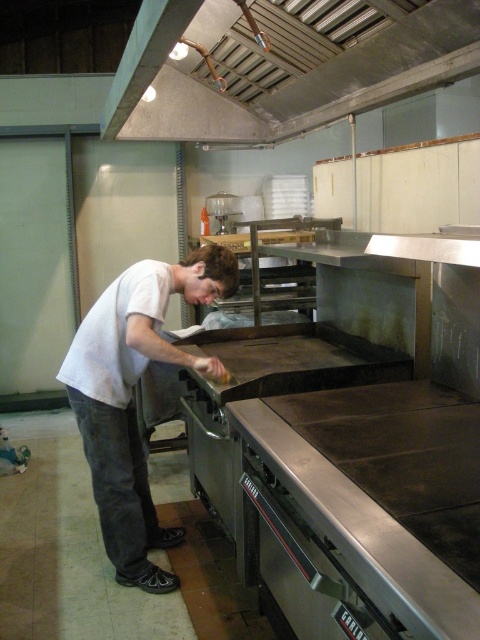
You are a chef working in this kitchen and need to reach an item on the shelf behind the metallic at upper center. Can you easily access it while standing in front of the white matte shirt at center?

The metallic at upper center is in front of the white matte shirt at center, so the metallic at upper center may block access to the shelf behind it. You might need to move around or step aside to reach the item on the shelf.

You are a chef in the kitchen. You need to reach the metallic at upper center while wearing the white matte shirt at center. Can you comfortably reach it without bending over too much?

The metallic at upper center is shorter than the white matte shirt at center, which suggests that the metallic object is lower in height. Since the shirt is at center and the metallic object is shorter, the chef may need to bend down slightly to reach it comfortably.

You are a new chef in the kitchen and need to place a small spice jar on the counter near the metallic at upper center without blocking the white matte shirt at center. Can you fit the spice jar between them?

The metallic at upper center might be wider than white matte shirt at center, so there may not be enough space to place the spice jar between them without blocking the white matte shirt at center.